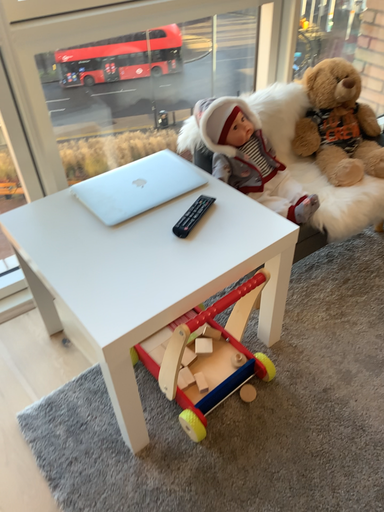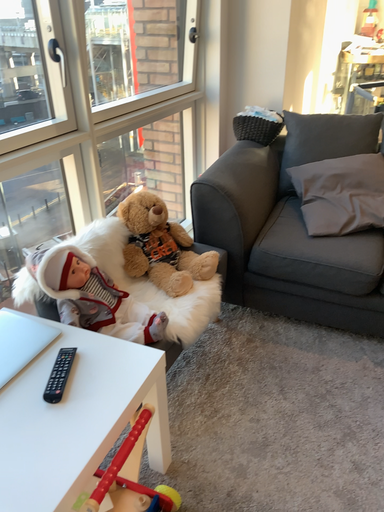
Question: How did the camera likely rotate when shooting the video?

Choices:
 (A) rotated downward
 (B) rotated upward

Answer: (B)